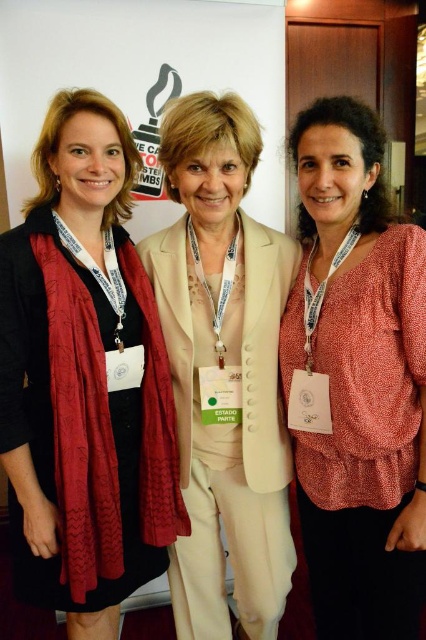
You are standing at the position of the viewer in the image. You want to pick up the matte black scarf at left without moving your feet. Can you reach it?

The matte black scarf at left is 1.27 meters away from the viewer. Since the average human arm length is about 0.7 meters, you cannot reach it without moving your feet.

You are a photographer at a formal event. You need to capture a photo where the metallic gold medal at center is clearly visible above the creamy satin suit at center. Is this possible based on their current positions?

The creamy satin suit at center has a greater height compared to the metallic gold medal at center, so the medal would be obscured by the suit and not visible above it.

You are organizing a photo shoot and need to ensure that the matte black scarf at left and the matte coral blouse at right are visible in the frame. Given their sizes, which one might require more space in the camera frame to be fully captured?

The matte black scarf at left is bigger than the matte coral blouse at right, so it would require more space in the camera frame to be fully captured.